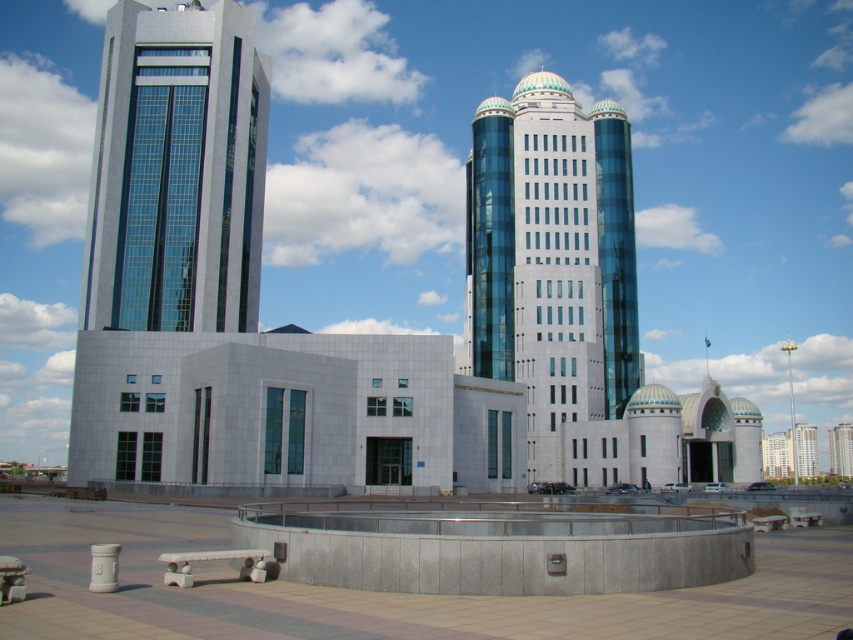
You are standing in the plaza in front of the central structure. You want to take a photo of both the matte glass tower at left and the glassy blue skyscraper at center. Which direction should you face to ensure both are visible in the frame?

You should face towards the right side of the plaza to capture both the matte glass tower at left and the glassy blue skyscraper at center in the frame since the matte glass tower at left is positioned to the left of the glassy blue skyscraper at center.

You are standing at the center of the circular plaza in front of the main architectural complex. Looking towards the central structures, can you tell me the 2D coordinates of the matte glass tower at left?

The 2D coordinates of the matte glass tower at left are at point (177, 172).